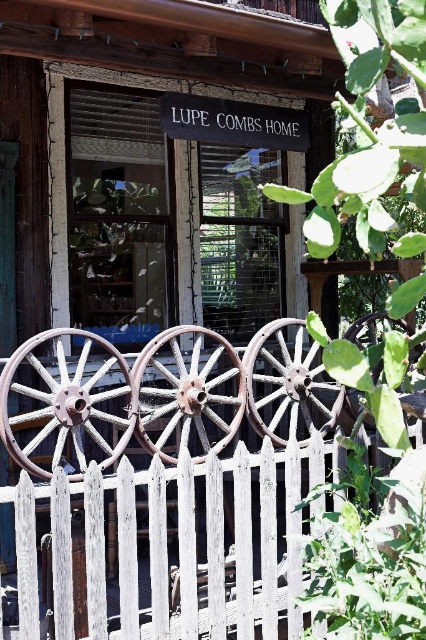
Question: Can you confirm if rusty metal wagon wheel at lower left is positioned to the right of rusty metal wheel at center?

Choices:
 (A) no
 (B) yes

Answer: (A)

Question: Is white wooden picket fence at center behind rusty metal wagon wheel at lower left?

Choices:
 (A) no
 (B) yes

Answer: (A)

Question: Considering the real-world distances, which object is closest to the rusty metal wagon wheel at center?

Choices:
 (A) white wooden picket fence at center
 (B) rusty metal wheel at center
 (C) rusty metal wagon wheel at lower left

Answer: (B)

Question: Based on their relative distances, which object is farther from the rusty metal wagon wheel at center?

Choices:
 (A) rusty wood wagon wheel at center
 (B) rusty metal wheel at center
 (C) white wooden picket fence at center

Answer: (C)

Question: Which point appears farthest from the camera in this image?

Choices:
 (A) (89, 586)
 (B) (351, 390)

Answer: (B)

Question: Does rusty metal wagon wheel at lower left lie behind rusty wood wagon wheel at center?

Choices:
 (A) no
 (B) yes

Answer: (B)